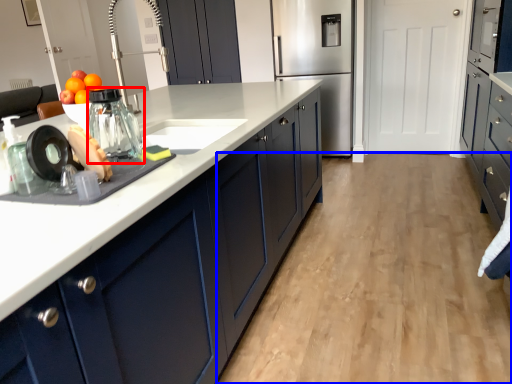
Question: Which point is closer to the camera, appliance (highlighted by a red box) or plain (highlighted by a blue box)?

Choices:
 (A) appliance
 (B) plain

Answer: (A)